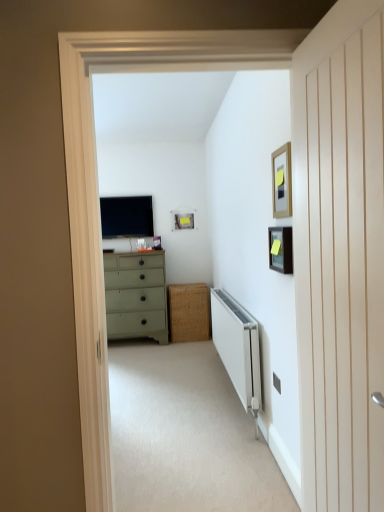
In order to face matte black tv at center, should I rotate leftwards or rightwards?

A 8.696 degree turn to the left will do.

Locate an element on the screen. This screenshot has width=384, height=512. wooden picture frame at upper right, positioned as the 1th picture frame in front-to-back order is located at coordinates (282, 182).

Measure the distance between white wood door at right and camera.

The depth of white wood door at right is 38.60 inches.

I want to click on matte black picture frame at upper center, which is counted as the third picture frame, starting from the right, so click(184, 219).

How much space does matte black picture frame at upper right, positioned as the second picture frame in right-to-left order, occupy horizontally?

1.35 inches.

This screenshot has width=384, height=512. What do you see at coordinates (188, 313) in the screenshot?
I see `bamboo mat at center` at bounding box center [188, 313].

This screenshot has width=384, height=512. Find the location of `matte black tv at center`. matte black tv at center is located at coordinates (126, 217).

Is matte black picture frame at upper center, the first picture frame in the back-to-front sequence, turned away from matte black picture frame at upper right, positioned as the second picture frame in left-to-right order?

matte black picture frame at upper center, the first picture frame in the back-to-front sequence, does not have its back to matte black picture frame at upper right, positioned as the second picture frame in left-to-right order.

Can you confirm if matte black picture frame at upper center, the first picture frame in the back-to-front sequence, is smaller than matte black picture frame at upper right, positioned as the second picture frame in left-to-right order?

No, matte black picture frame at upper center, the first picture frame in the back-to-front sequence, is not smaller than matte black picture frame at upper right, positioned as the second picture frame in left-to-right order.

Based on the photo, does matte black picture frame at upper center, which ranks as the third picture frame in front-to-back order, touch matte black picture frame at upper right, the 2th picture frame in the back-to-front sequence?

No, matte black picture frame at upper center, which ranks as the third picture frame in front-to-back order, is not next to matte black picture frame at upper right, the 2th picture frame in the back-to-front sequence.

Which is more to the right, beige carpet at center or white wood door at right?

Positioned to the right is white wood door at right.

Locate an element on the screen. Image resolution: width=384 pixels, height=512 pixels. door in front of the beige carpet at center is located at coordinates (340, 255).

Measure the distance between beige carpet at center and white wood door at right.

1.62 meters.

Is beige carpet at center taller than white wood door at right?

No.

From the image's perspective, which one is positioned lower, matte black picture frame at upper center, which ranks as the third picture frame in front-to-back order, or beige carpet at center?

beige carpet at center appears lower in the image.

Is matte black picture frame at upper center, which is counted as the third picture frame, starting from the right, not inside beige carpet at center?

Yes, matte black picture frame at upper center, which is counted as the third picture frame, starting from the right, is not within beige carpet at center.

Could you tell me if matte black picture frame at upper center, which ranks as the third picture frame in front-to-back order, is turned towards beige carpet at center?

No, matte black picture frame at upper center, which ranks as the third picture frame in front-to-back order, is not oriented towards beige carpet at center.

Which of these two, matte black picture frame at upper center, which ranks as the third picture frame in front-to-back order, or beige carpet at center, stands taller?

Standing taller between the two is matte black picture frame at upper center, which ranks as the third picture frame in front-to-back order.

Looking at this image, between wooden picture frame at upper right, positioned as the 1th picture frame in front-to-back order, and light green painted wood chest of drawers at center, which one has less height?

With less height is wooden picture frame at upper right, positioned as the 1th picture frame in front-to-back order.

Consider the image. From the image's perspective, is wooden picture frame at upper right, the third picture frame viewed from the back, positioned above or below light green painted wood chest of drawers at center?

Based on their image positions, wooden picture frame at upper right, the third picture frame viewed from the back, is located above light green painted wood chest of drawers at center.

Between wooden picture frame at upper right, positioned as the 1th picture frame in front-to-back order, and light green painted wood chest of drawers at center, which one has larger size?

light green painted wood chest of drawers at center.

Is wooden picture frame at upper right, the third picture frame viewed from the back, at the left side of light green painted wood chest of drawers at center?

In fact, wooden picture frame at upper right, the third picture frame viewed from the back, is to the right of light green painted wood chest of drawers at center.

Is matte black tv at center positioned behind matte black picture frame at upper center, which ranks as the third picture frame in front-to-back order?

No, matte black tv at center is closer to the viewer.

What's the angular difference between matte black tv at center and matte black picture frame at upper center, which ranks as the 1th picture frame in left-to-right order,'s facing directions?

The angle between the facing direction of matte black tv at center and the facing direction of matte black picture frame at upper center, which ranks as the 1th picture frame in left-to-right order, is 0.264 degrees.

From the image's perspective, is matte black tv at center located beneath matte black picture frame at upper center, which is counted as the third picture frame, starting from the right?

No.

Is matte black tv at center oriented away from matte black picture frame at upper center, which is counted as the third picture frame, starting from the right?

matte black tv at center does not have its back to matte black picture frame at upper center, which is counted as the third picture frame, starting from the right.

This screenshot has height=512, width=384. Identify the location of cabinetry that appears below the white metallic radiator at lower center (from the image's perspective). (188, 313).

Considering the positions of objects bamboo mat at center and white metallic radiator at lower center in the image provided, who is more to the left, bamboo mat at center or white metallic radiator at lower center?

From the viewer's perspective, bamboo mat at center appears more on the left side.

Between point (184, 306) and point (222, 323), which one is positioned behind?

The point (184, 306) is farther.

From the image's perspective, between bamboo mat at center and white metallic radiator at lower center, which one is located above?

white metallic radiator at lower center appears higher in the image.

Which object is positioned more to the left, white metallic radiator at lower center or beige carpet at center?

Positioned to the left is beige carpet at center.

Is point (221, 302) in front of point (198, 368)?

Yes.

In the image, is white metallic radiator at lower center positioned in front of or behind beige carpet at center?

white metallic radiator at lower center is behind beige carpet at center.

Consider the image. From their relative heights in the image, would you say white metallic radiator at lower center is taller or shorter than beige carpet at center?

Clearly, white metallic radiator at lower center is taller compared to beige carpet at center.

You are a GUI agent. You are given a task and a screenshot of the screen. Output one action in this format:
    pyautogui.click(x=<x>, y=<y>)
    Task: Click on the 2nd picture frame positioned above the matte black picture frame at upper right, positioned as the second picture frame in left-to-right order (from the image's perspective)
    Image resolution: width=384 pixels, height=512 pixels.
    Given the screenshot: What is the action you would take?
    pyautogui.click(x=184, y=219)

Locate an element on the screen. corridor located on the left of white wood door at right is located at coordinates (186, 434).

Looking at the image, which one is located closer to matte black tv at center, bamboo mat at center or matte black picture frame at upper right, the 2th picture frame viewed from the front?

bamboo mat at center is closer to matte black tv at center.

Looking at the image, which one is located closer to matte black picture frame at upper right, positioned as the second picture frame in left-to-right order, beige carpet at center or wooden picture frame at upper right, which appears as the 3th picture frame when viewed from the left?

The object closer to matte black picture frame at upper right, positioned as the second picture frame in left-to-right order, is wooden picture frame at upper right, which appears as the 3th picture frame when viewed from the left.

Which object lies further to the anchor point white wood door at right, bamboo mat at center or beige carpet at center?

Among the two, bamboo mat at center is located further to white wood door at right.

Estimate the real-world distances between objects in this image. Which object is closer to white metallic radiator at lower center, matte black picture frame at upper center, which ranks as the 1th picture frame in left-to-right order, or matte black picture frame at upper right, the 2th picture frame viewed from the front?

matte black picture frame at upper right, the 2th picture frame viewed from the front.

From the image, which object appears to be farther from white metallic radiator at lower center, wooden picture frame at upper right, which appears as the 3th picture frame when viewed from the left, or matte black picture frame at upper right, positioned as the second picture frame in left-to-right order?

wooden picture frame at upper right, which appears as the 3th picture frame when viewed from the left, lies further to white metallic radiator at lower center than the other object.

Considering their positions, is matte black picture frame at upper center, which ranks as the 1th picture frame in left-to-right order, positioned closer to white wood door at right than wooden picture frame at upper right, positioned as the 1th picture frame in front-to-back order?

wooden picture frame at upper right, positioned as the 1th picture frame in front-to-back order, lies closer to white wood door at right than the other object.

Considering their positions, is matte black tv at center positioned further to wooden picture frame at upper right, which appears as the 3th picture frame when viewed from the left, than light green painted wood chest of drawers at center?

matte black tv at center lies further to wooden picture frame at upper right, which appears as the 3th picture frame when viewed from the left, than the other object.

From the image, which object appears to be farther from matte black picture frame at upper right, the 2th picture frame in the back-to-front sequence, light green painted wood chest of drawers at center or white metallic radiator at lower center?

light green painted wood chest of drawers at center is positioned further to the anchor matte black picture frame at upper right, the 2th picture frame in the back-to-front sequence.

The width and height of the screenshot is (384, 512). I want to click on radiator located between wooden picture frame at upper right, the third picture frame viewed from the back, and light green painted wood chest of drawers at center in the depth direction, so click(238, 349).

The image size is (384, 512). What are the coordinates of `cabinetry located between wooden picture frame at upper right, positioned as the 1th picture frame in front-to-back order, and matte black tv at center in the depth direction` in the screenshot? It's located at (188, 313).

The width and height of the screenshot is (384, 512). I want to click on the chest of drawers located between beige carpet at center and bamboo mat at center in the depth direction, so click(x=136, y=296).

Where is `radiator between matte black picture frame at upper right, the 2th picture frame in the back-to-front sequence, and bamboo mat at center from front to back`? radiator between matte black picture frame at upper right, the 2th picture frame in the back-to-front sequence, and bamboo mat at center from front to back is located at coordinates (238, 349).